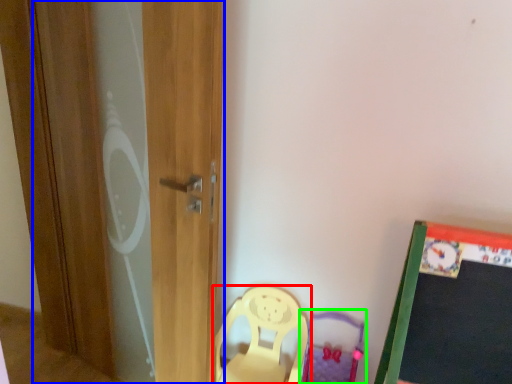
Question: Which object is positioned closest to chair (highlighted by a red box)? Select from screen door (highlighted by a blue box) and swivel chair (highlighted by a green box).

Choices:
 (A) screen door
 (B) swivel chair

Answer: (B)